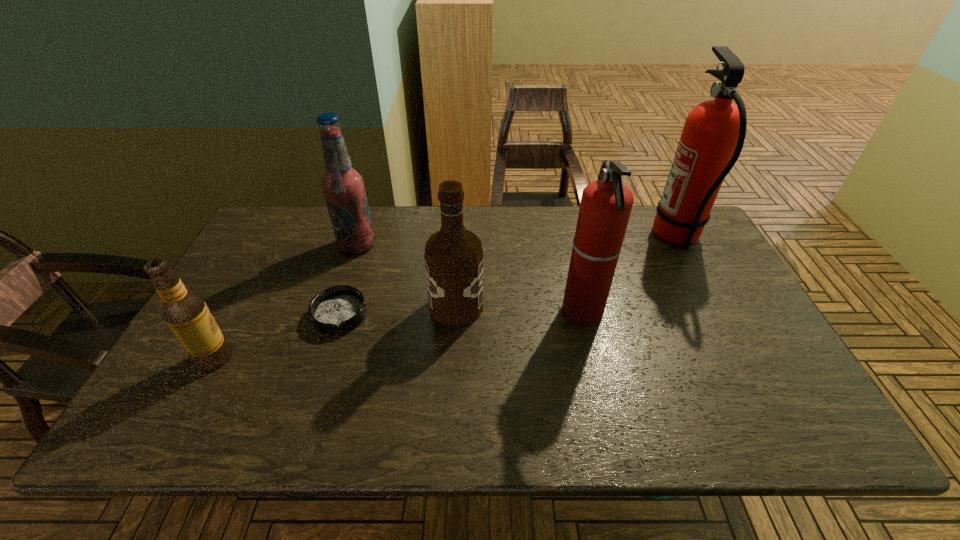
Select which object appears as the second closest to the second farthest alcohol. Please provide its 2D coordinates. Your answer should be formatted as a tuple, i.e. [(x, y)], where the tuple contains the x and y coordinates of a point satisfying the conditions above.

[(606, 204)]

I want to click on alcohol that is the closest to the leftmost alcohol, so click(x=343, y=187).

Select which alcohol is the closest to the second nearest alcohol. Please provide its 2D coordinates. Your answer should be formatted as a tuple, i.e. [(x, y)], where the tuple contains the x and y coordinates of a point satisfying the conditions above.

[(343, 187)]

Where is `vacant region that satisfies the following two spatial constraints: 1. on the front side of the ashtray; 2. on the label of the shortest alcohol`? The width and height of the screenshot is (960, 540). vacant region that satisfies the following two spatial constraints: 1. on the front side of the ashtray; 2. on the label of the shortest alcohol is located at coordinates (326, 357).